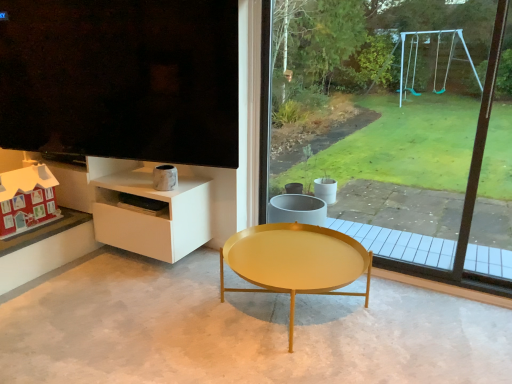
Where is `white glossy shelf at lower left`? This screenshot has width=512, height=384. white glossy shelf at lower left is located at coordinates (149, 209).

Describe the element at coordinates (396, 126) in the screenshot. I see `transparent glass window at center` at that location.

Measure the distance between point [138,142] and camera.

They are 2.28 meters apart.

The width and height of the screenshot is (512, 384). In order to click on white glossy shelf at lower left in this screenshot , I will do `click(149, 209)`.

Between matte red wooden house at lower left and transparent glass window at center, which one has larger width?

Wider between the two is matte red wooden house at lower left.

Considering the positions of points (46, 170) and (479, 62), is point (46, 170) farther from camera compared to point (479, 62)?

No.

Considering the positions of objects matte red wooden house at lower left and transparent glass window at center in the image provided, who is in front, matte red wooden house at lower left or transparent glass window at center?

transparent glass window at center.

Considering the relative sizes of matte red wooden house at lower left and transparent glass window at center in the image provided, is matte red wooden house at lower left bigger than transparent glass window at center?

Actually, matte red wooden house at lower left might be smaller than transparent glass window at center.

From a real-world perspective, which object rests below the other?

gold metallic coffee table at center.

Does transparent glass window at center have a lesser width compared to gold metallic coffee table at center?

Indeed, transparent glass window at center has a lesser width compared to gold metallic coffee table at center.

Is gold metallic coffee table at center inside transparent glass window at center?

That's incorrect, gold metallic coffee table at center is not inside transparent glass window at center.

In the image, there is a transparent glass window at center. Identify the location of coffee table below it (from the image's perspective). This screenshot has width=512, height=384. (295, 261).

From a real-world perspective, is matte black screen at upper left on top of gold metallic coffee table at center?

Indeed, from a real-world perspective, matte black screen at upper left stands above gold metallic coffee table at center.

From the image's perspective, relative to gold metallic coffee table at center, is matte black screen at upper left above or below?

matte black screen at upper left is situated higher than gold metallic coffee table at center in the image.

Considering the positions of objects matte black screen at upper left and gold metallic coffee table at center in the image provided, who is more to the right, matte black screen at upper left or gold metallic coffee table at center?

Positioned to the right is gold metallic coffee table at center.

Which of these two, matte black screen at upper left or gold metallic coffee table at center, is wider?

Wider between the two is gold metallic coffee table at center.

Could you tell me if gold metallic coffee table at center is turned towards white glossy shelf at lower left?

No, gold metallic coffee table at center is not facing towards white glossy shelf at lower left.

Does gold metallic coffee table at center have a smaller size compared to white glossy shelf at lower left?

Incorrect, gold metallic coffee table at center is not smaller in size than white glossy shelf at lower left.

Which object is closer to the camera taking this photo, gold metallic coffee table at center or white glossy shelf at lower left?

gold metallic coffee table at center.

Is gold metallic coffee table at center thinner than white glossy shelf at lower left?

In fact, gold metallic coffee table at center might be wider than white glossy shelf at lower left.

This screenshot has height=384, width=512. What are the coordinates of `toy to the left of gold metallic coffee table at center` in the screenshot? It's located at click(27, 199).

Is gold metallic coffee table at center shorter than matte red wooden house at lower left?

Correct, gold metallic coffee table at center is not as tall as matte red wooden house at lower left.

Is gold metallic coffee table at center in contact with matte red wooden house at lower left?

No, gold metallic coffee table at center is not beside matte red wooden house at lower left.

Considering the positions of points (366, 283) and (53, 211), is point (366, 283) closer to camera compared to point (53, 211)?

That is True.

Considering the sizes of objects white glossy shelf at lower left and gold metallic coffee table at center in the image provided, who is shorter, white glossy shelf at lower left or gold metallic coffee table at center?

Standing shorter between the two is gold metallic coffee table at center.

Image resolution: width=512 pixels, height=384 pixels. Identify the location of shelf above the gold metallic coffee table at center (from the image's perspective). (149, 209).

Is white glossy shelf at lower left in front of or behind gold metallic coffee table at center in the image?

In the image, white glossy shelf at lower left appears behind gold metallic coffee table at center.

Does white glossy shelf at lower left appear on the right side of gold metallic coffee table at center?

No, white glossy shelf at lower left is not to the right of gold metallic coffee table at center.

Which object is positioned more to the left, transparent glass window at center or matte red wooden house at lower left?

From the viewer's perspective, matte red wooden house at lower left appears more on the left side.

Is transparent glass window at center with matte red wooden house at lower left?

No.

What's the angular difference between transparent glass window at center and matte red wooden house at lower left's facing directions?

The angular difference between transparent glass window at center and matte red wooden house at lower left is 89.7 degrees.

From the image's perspective, is transparent glass window at center over matte red wooden house at lower left?

Yes.

Where is `window above the matte red wooden house at lower left (from the image's perspective)`? The height and width of the screenshot is (384, 512). window above the matte red wooden house at lower left (from the image's perspective) is located at coordinates (396, 126).

Identify the location of coffee table that appears on the left of transparent glass window at center. This screenshot has width=512, height=384. (295, 261).

Based on their spatial positions, is matte black screen at upper left or white glossy shelf at lower left closer to gold metallic coffee table at center?

white glossy shelf at lower left is positioned closer to the anchor gold metallic coffee table at center.

From the image, which object appears to be farther from transparent glass window at center, matte black screen at upper left or matte red wooden house at lower left?

Based on the image, matte red wooden house at lower left appears to be further to transparent glass window at center.

Estimate the real-world distances between objects in this image. Which object is further from transparent glass window at center, gold metallic coffee table at center or matte black screen at upper left?

matte black screen at upper left.

Estimate the real-world distances between objects in this image. Which object is closer to white glossy shelf at lower left, matte red wooden house at lower left or matte black screen at upper left?

The object closer to white glossy shelf at lower left is matte black screen at upper left.

Estimate the real-world distances between objects in this image. Which object is closer to matte black screen at upper left, white glossy shelf at lower left or gold metallic coffee table at center?

white glossy shelf at lower left.

Considering their positions, is transparent glass window at center positioned further to matte black screen at upper left than gold metallic coffee table at center?

transparent glass window at center is further to matte black screen at upper left.

From the image, which object appears to be farther from white glossy shelf at lower left, transparent glass window at center or matte black screen at upper left?

Based on the image, transparent glass window at center appears to be further to white glossy shelf at lower left.

From the image, which object appears to be farther from matte black screen at upper left, transparent glass window at center or white glossy shelf at lower left?

The object further to matte black screen at upper left is transparent glass window at center.

Find the location of `coffee table located between white glossy shelf at lower left and transparent glass window at center in the left-right direction`. coffee table located between white glossy shelf at lower left and transparent glass window at center in the left-right direction is located at coordinates (295, 261).

Identify the location of toy that lies between matte black screen at upper left and white glossy shelf at lower left from top to bottom. (27, 199).

Locate an element on the screen. This screenshot has height=384, width=512. shelf located between matte black screen at upper left and transparent glass window at center in the left-right direction is located at coordinates (149, 209).

Where is `shelf between matte black screen at upper left and gold metallic coffee table at center`? Image resolution: width=512 pixels, height=384 pixels. shelf between matte black screen at upper left and gold metallic coffee table at center is located at coordinates (149, 209).